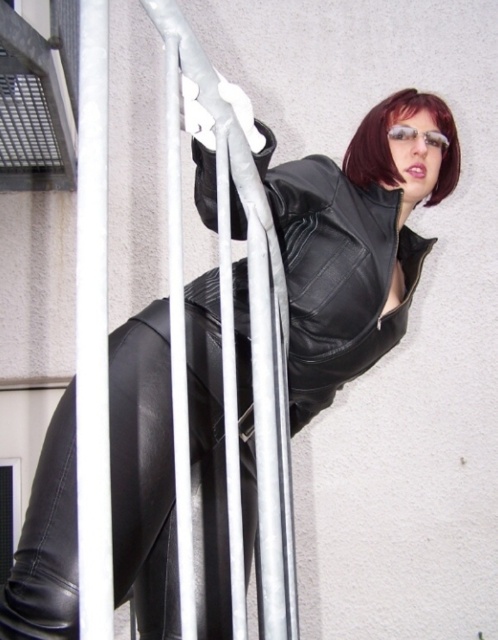
Does black leather pants at center have a smaller size compared to dark red hair at upper center?

Incorrect, black leather pants at center is not smaller in size than dark red hair at upper center.

Identify the location of black leather pants at center. (143, 472).

Does black leather pants at center have a larger size compared to black leather jacket at center?

No, black leather pants at center is not bigger than black leather jacket at center.

Is black leather pants at center further to the viewer compared to black leather jacket at center?

No.

Locate an element on the screen. This screenshot has height=640, width=498. black leather pants at center is located at coordinates (143, 472).

How far apart are black leather jacket at center and dark red hair at upper center?

black leather jacket at center and dark red hair at upper center are 9.66 inches apart.

Is black leather jacket at center to the right of dark red hair at upper center from the viewer's perspective?

No, black leather jacket at center is not to the right of dark red hair at upper center.

Where is `black leather jacket at center`? The image size is (498, 640). black leather jacket at center is located at coordinates (336, 273).